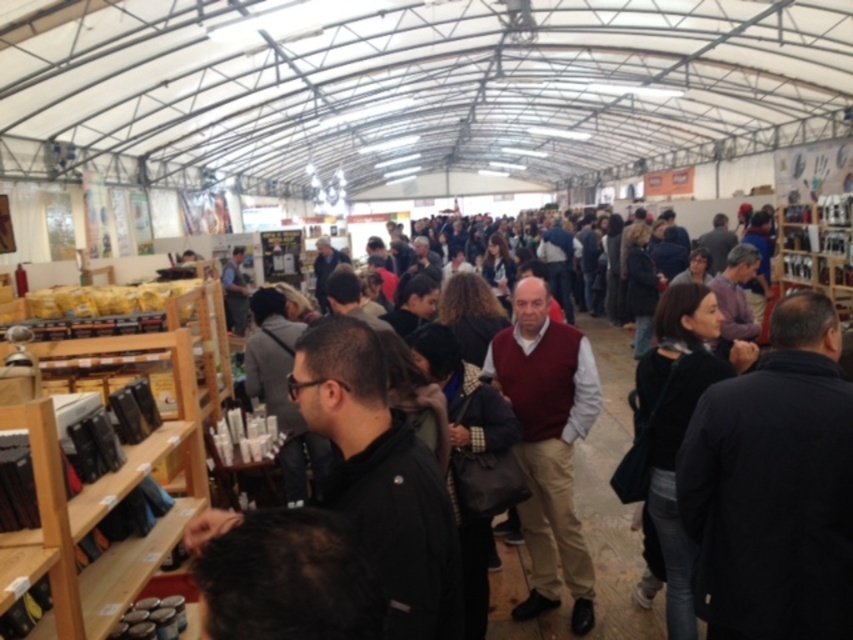
Who is more distant from viewer, (126, 589) or (544, 337)?

Point (544, 337)

Image resolution: width=853 pixels, height=640 pixels. What do you see at coordinates (125, 467) in the screenshot? I see `wooden shelves at left` at bounding box center [125, 467].

This screenshot has height=640, width=853. I want to click on wooden shelves at left, so click(125, 467).